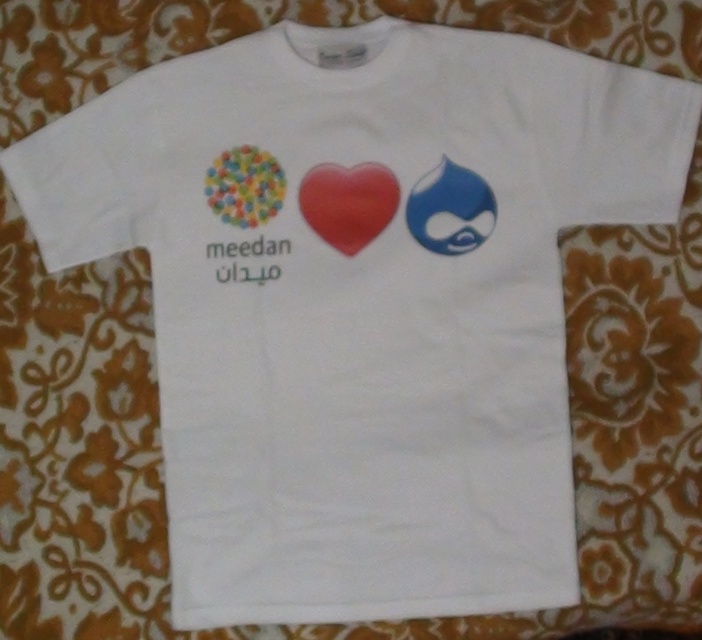
Is matte red heart at center positioned before blue glossy whale at upper right?

No.

Which is in front, point (336, 241) or point (463, 168)?

Point (463, 168)

You are a GUI agent. You are given a task and a screenshot of the screen. Output one action in this format:
    pyautogui.click(x=<x>, y=<y>)
    Task: Click on the matte red heart at center
    
    Given the screenshot: What is the action you would take?
    (347, 202)

Does matte red heart at center appear over multicolored glossy beads at upper left?

Actually, matte red heart at center is below multicolored glossy beads at upper left.

Is matte red heart at center to the left of multicolored glossy beads at upper left from the viewer's perspective?

Incorrect, matte red heart at center is not on the left side of multicolored glossy beads at upper left.

Where is `matte red heart at center`? matte red heart at center is located at coordinates (347, 202).

Is blue glossy whale at upper right taller than multicolored glossy beads at upper left?

Yes.

Between blue glossy whale at upper right and multicolored glossy beads at upper left, which one appears on the left side from the viewer's perspective?

multicolored glossy beads at upper left is more to the left.

Identify the location of blue glossy whale at upper right. (450, 209).